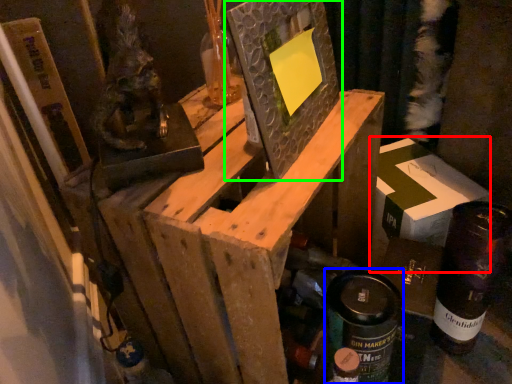
Question: Which object is positioned farthest from cardboard box (highlighted by a red box)? Select from spray can (highlighted by a blue box) and picture frame (highlighted by a green box).

Choices:
 (A) spray can
 (B) picture frame

Answer: (B)